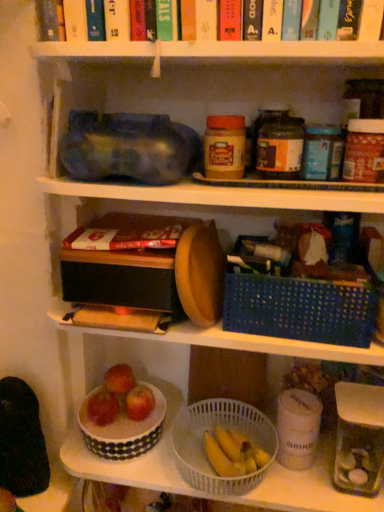
Question: Is red matte apple at lower center, which is the third apple from right to left, turned away from clear glass jar at lower right?

Choices:
 (A) no
 (B) yes

Answer: (A)

Question: Does red matte apple at lower center, the first apple when ordered from left to right, have a larger size compared to clear glass jar at lower right?

Choices:
 (A) no
 (B) yes

Answer: (A)

Question: From a real-world perspective, is red matte apple at lower center, the first apple when ordered from left to right, physically below clear glass jar at lower right?

Choices:
 (A) no
 (B) yes

Answer: (B)

Question: Is red matte apple at lower center, which is the third apple from right to left, at the left side of clear glass jar at lower right?

Choices:
 (A) yes
 (B) no

Answer: (A)

Question: Does red matte apple at lower center, which is the third apple from right to left, touch clear glass jar at lower right?

Choices:
 (A) yes
 (B) no

Answer: (B)

Question: Is the depth of red matte apple at lower center, the first apple when ordered from left to right, greater than that of clear glass jar at lower right?

Choices:
 (A) no
 (B) yes

Answer: (B)

Question: From the image's perspective, is white polka dot bowl at lower center located above red matte apple at lower center, which is the third apple from right to left?

Choices:
 (A) no
 (B) yes

Answer: (A)

Question: Considering the relative sizes of white polka dot bowl at lower center and red matte apple at lower center, which is the third apple from right to left, in the image provided, is white polka dot bowl at lower center bigger than red matte apple at lower center, which is the third apple from right to left,?

Choices:
 (A) no
 (B) yes

Answer: (B)

Question: From the image's perspective, is white polka dot bowl at lower center under red matte apple at lower center, which is the third apple from right to left?

Choices:
 (A) yes
 (B) no

Answer: (A)

Question: Is white polka dot bowl at lower center positioned beyond the bounds of red matte apple at lower center, the first apple when ordered from left to right?

Choices:
 (A) no
 (B) yes

Answer: (B)

Question: From a real-world perspective, is white polka dot bowl at lower center over red matte apple at lower center, which is the third apple from right to left?

Choices:
 (A) no
 (B) yes

Answer: (A)

Question: Is white polka dot bowl at lower center wider than red matte apple at lower center, which is the third apple from right to left?

Choices:
 (A) no
 (B) yes

Answer: (B)

Question: Considering the relative sizes of shiny red apple at lower center, placed as the 2th apple when sorted from left to right, and red matte apple at lower center, which is the third apple from right to left, in the image provided, is shiny red apple at lower center, placed as the 2th apple when sorted from left to right, taller than red matte apple at lower center, which is the third apple from right to left,?

Choices:
 (A) no
 (B) yes

Answer: (A)